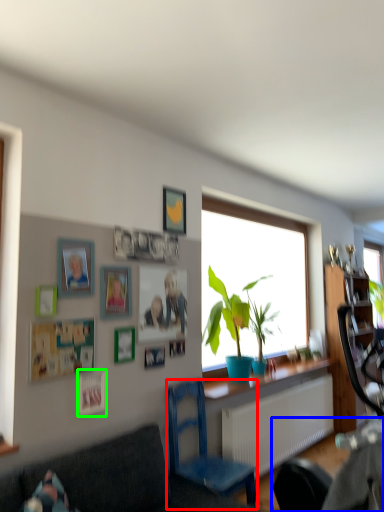
Question: Which is nearer to the chair (highlighted by a red box)? rocking chair (highlighted by a blue box) or picture frame (highlighted by a green box).

Choices:
 (A) rocking chair
 (B) picture frame

Answer: (A)